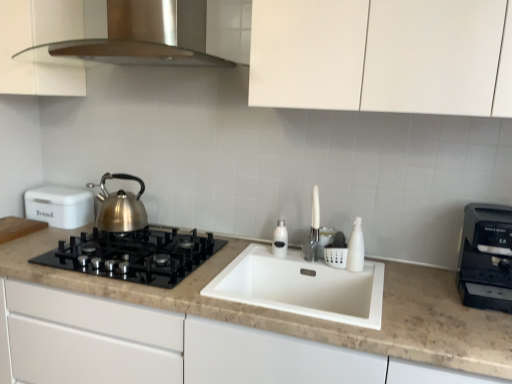
What do you see at coordinates (280, 240) in the screenshot? I see `satin silver soap dispenser at sink, acting as the 2th bottle starting from the front` at bounding box center [280, 240].

At what (x,y) coordinates should I click in order to perform the action: click on black plastic toaster at right, arranged as the second kitchen appliance when viewed from the left. Please return your answer as a coordinate pair (x, y). This screenshot has width=512, height=384. Looking at the image, I should click on (486, 257).

What do you see at coordinates (60, 206) in the screenshot? I see `white matte bread bin at left, marked as the 2th kitchen appliance in a right-to-left arrangement` at bounding box center [60, 206].

The height and width of the screenshot is (384, 512). Describe the element at coordinates (356, 248) in the screenshot. I see `white plastic bottle at sink, which ranks as the 1th bottle in front-to-back order` at that location.

Where is `satin silver range hood at upper center`? satin silver range hood at upper center is located at coordinates (140, 37).

This screenshot has width=512, height=384. In order to click on gas stove on the left of white plastic bottle at sink, the 1th bottle when ordered from right to left in this screenshot , I will do `click(134, 255)`.

From the image's perspective, which object appears higher, white plastic bottle at sink, the 2th bottle when ordered from left to right, or black glass gas stove at left?

white plastic bottle at sink, the 2th bottle when ordered from left to right, from the image's perspective.

Is white plastic bottle at sink, the 1th bottle when ordered from right to left, bigger than black glass gas stove at left?

No, white plastic bottle at sink, the 1th bottle when ordered from right to left, is not bigger than black glass gas stove at left.

How many degrees apart are the facing directions of white plastic bottle at sink, the 2th bottle in the back-to-front sequence, and black glass gas stove at left?

They differ by 0.974 degrees in their facing directions.

In the scene shown: Is white matte bread bin at left, arranged as the first kitchen appliance when viewed from the left, with black glass gas stove at left?

white matte bread bin at left, arranged as the first kitchen appliance when viewed from the left, is not next to black glass gas stove at left, and they're not touching.

From the picture: Between white matte bread bin at left, the second kitchen appliance from the front, and black glass gas stove at left, which one is positioned in front?

black glass gas stove at left is more forward.

Does point (45, 218) lie in front of point (97, 256)?

No.

Is white matte bread bin at left, marked as the 2th kitchen appliance in a right-to-left arrangement, completely or partially outside of black glass gas stove at left?

white matte bread bin at left, marked as the 2th kitchen appliance in a right-to-left arrangement, is positioned outside black glass gas stove at left.

Consider the image. Considering the relative positions of satin silver soap dispenser at sink, the 2th bottle when ordered from right to left, and white plastic bottle at sink, the 1th bottle when ordered from right to left, in the image provided, is satin silver soap dispenser at sink, the 2th bottle when ordered from right to left, behind white plastic bottle at sink, the 1th bottle when ordered from right to left,?

Yes, it is behind white plastic bottle at sink, the 1th bottle when ordered from right to left.

Is point (279, 241) in front of point (355, 252)?

No, it is not.

From the image's perspective, relative to white plastic bottle at sink, the 2th bottle when ordered from left to right, is satin silver soap dispenser at sink, acting as the 2th bottle starting from the front, above or below?

Clearly, from the image's perspective, satin silver soap dispenser at sink, acting as the 2th bottle starting from the front, is above white plastic bottle at sink, the 2th bottle when ordered from left to right.

Which of these two, satin silver soap dispenser at sink, the 2th bottle when ordered from right to left, or white plastic bottle at sink, the 2th bottle when ordered from left to right, is wider?

With larger width is white plastic bottle at sink, the 2th bottle when ordered from left to right.

From the picture: Is white plastic bottle at sink, the 2th bottle in the back-to-front sequence, not near white matte cabinet at upper left?

white plastic bottle at sink, the 2th bottle in the back-to-front sequence, is far away from white matte cabinet at upper left.

Can you confirm if white plastic bottle at sink, the 2th bottle when ordered from left to right, is bigger than white matte cabinet at upper left?

Actually, white plastic bottle at sink, the 2th bottle when ordered from left to right, might be smaller than white matte cabinet at upper left.

From a real-world perspective, relative to white matte cabinet at upper left, is white plastic bottle at sink, the 2th bottle in the back-to-front sequence, vertically above or below?

In terms of real-world spatial position, white plastic bottle at sink, the 2th bottle in the back-to-front sequence, is below white matte cabinet at upper left.

Looking at this image, is brushed metal kettle at left not close to white matte bread bin at left, the second kitchen appliance from the front?

No, there isn't a large distance between brushed metal kettle at left and white matte bread bin at left, the second kitchen appliance from the front.

Considering the sizes of objects brushed metal kettle at left and white matte bread bin at left, the second kitchen appliance from the front, in the image provided, who is bigger, brushed metal kettle at left or white matte bread bin at left, the second kitchen appliance from the front,?

Bigger between the two is white matte bread bin at left, the second kitchen appliance from the front.

Does point (135, 210) come farther from viewer compared to point (68, 203)?

No, it is not.

Is brushed metal kettle at left positioned behind black plastic toaster at right, arranged as the second kitchen appliance when viewed from the left?

Yes.

From a real-world perspective, which is physically below, brushed metal kettle at left or black plastic toaster at right, arranged as the second kitchen appliance when viewed from the left?

black plastic toaster at right, arranged as the second kitchen appliance when viewed from the left, is physically lower.

Which is closer to the camera, (126,210) or (504,289)?

The point (504,289) is closer.

Is white matte bread bin at left, the second kitchen appliance from the front, facing away from white plastic bottle at sink, the 2th bottle when ordered from left to right?

No, white matte bread bin at left, the second kitchen appliance from the front, is not facing away from white plastic bottle at sink, the 2th bottle when ordered from left to right.

Is white matte bread bin at left, marked as the 2th kitchen appliance in a right-to-left arrangement, positioned before white plastic bottle at sink, the 2th bottle in the back-to-front sequence?

That is False.

Considering the sizes of objects white matte bread bin at left, marked as the 2th kitchen appliance in a right-to-left arrangement, and white plastic bottle at sink, which ranks as the 1th bottle in front-to-back order, in the image provided, who is thinner, white matte bread bin at left, marked as the 2th kitchen appliance in a right-to-left arrangement, or white plastic bottle at sink, which ranks as the 1th bottle in front-to-back order,?

With smaller width is white plastic bottle at sink, which ranks as the 1th bottle in front-to-back order.

Between white matte bread bin at left, the first kitchen appliance from the back, and white plastic bottle at sink, the 2th bottle in the back-to-front sequence, which one appears on the left side from the viewer's perspective?

Answer: From the viewer's perspective, white matte bread bin at left, the first kitchen appliance from the back, appears more on the left side.

From a real-world perspective, count 2nd bottles upward from the black glass gas stove at left and point to it. Please provide its 2D coordinates.

[(356, 248)]

Locate an element on the screen. gas stove lying on the right of white matte bread bin at left, marked as the 2th kitchen appliance in a right-to-left arrangement is located at coordinates (134, 255).

Based on their spatial positions, is satin silver range hood at upper center or satin silver soap dispenser at sink, the 1th bottle in the left-to-right sequence, further from white plastic bottle at sink, which ranks as the 1th bottle in front-to-back order?

satin silver range hood at upper center lies further to white plastic bottle at sink, which ranks as the 1th bottle in front-to-back order, than the other object.

From the image, which object appears to be nearer to black plastic toaster at right, marked as the second kitchen appliance in a back-to-front arrangement, black glass gas stove at left or white matte cabinet at upper left?

The object closer to black plastic toaster at right, marked as the second kitchen appliance in a back-to-front arrangement, is black glass gas stove at left.

Looking at the image, which one is located further to satin silver soap dispenser at sink, the 2th bottle when ordered from right to left, white matte cabinet at upper left or black glass gas stove at left?

The object further to satin silver soap dispenser at sink, the 2th bottle when ordered from right to left, is white matte cabinet at upper left.

When comparing their distances from black glass gas stove at left, does brushed metal kettle at left or black plastic toaster at right, which is the 1th kitchen appliance in front-to-back order, seem further?

black plastic toaster at right, which is the 1th kitchen appliance in front-to-back order, is positioned further to the anchor black glass gas stove at left.

Estimate the real-world distances between objects in this image. Which object is closer to black plastic toaster at right, which is the 1th kitchen appliance in front-to-back order, brushed metal kettle at left or satin silver range hood at upper center?

brushed metal kettle at left lies closer to black plastic toaster at right, which is the 1th kitchen appliance in front-to-back order, than the other object.

Estimate the real-world distances between objects in this image. Which object is further from white plastic bottle at sink, the 1th bottle when ordered from right to left, satin silver range hood at upper center or black plastic toaster at right, placed as the first kitchen appliance when sorted from right to left?

satin silver range hood at upper center.

Considering their positions, is white matte cabinet at upper left positioned closer to satin silver range hood at upper center than black glass gas stove at left?

Based on the image, white matte cabinet at upper left appears to be nearer to satin silver range hood at upper center.

Considering their positions, is satin silver soap dispenser at sink, the 2th bottle when ordered from right to left, positioned closer to brushed metal kettle at left than white matte bread bin at left, arranged as the first kitchen appliance when viewed from the left?

The object closer to brushed metal kettle at left is white matte bread bin at left, arranged as the first kitchen appliance when viewed from the left.

Where is `kettle between black glass gas stove at left and white matte bread bin at left, the second kitchen appliance from the front, along the z-axis`? kettle between black glass gas stove at left and white matte bread bin at left, the second kitchen appliance from the front, along the z-axis is located at coordinates (120, 207).

This screenshot has height=384, width=512. I want to click on bottle between white matte cabinet at upper left and white plastic bottle at sink, which ranks as the 1th bottle in front-to-back order, from left to right, so click(280, 240).

Locate an element on the screen. The height and width of the screenshot is (384, 512). cabinetry between satin silver range hood at upper center and brushed metal kettle at left in the up-down direction is located at coordinates (39, 48).

The image size is (512, 384). Find the location of `home appliance located between white matte bread bin at left, marked as the 2th kitchen appliance in a right-to-left arrangement, and satin silver soap dispenser at sink, the 1th bottle in the left-to-right sequence, in the left-right direction`. home appliance located between white matte bread bin at left, marked as the 2th kitchen appliance in a right-to-left arrangement, and satin silver soap dispenser at sink, the 1th bottle in the left-to-right sequence, in the left-right direction is located at coordinates (140, 37).